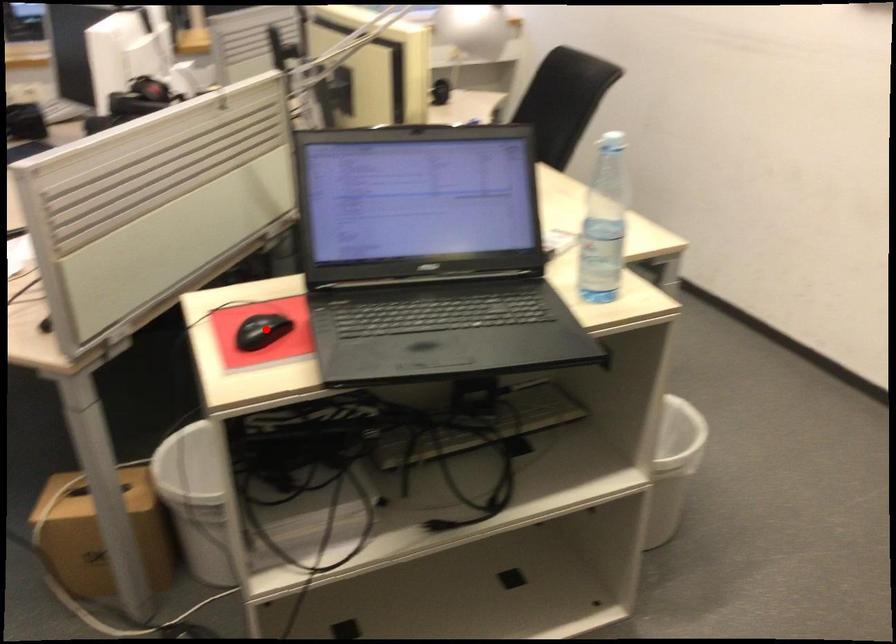
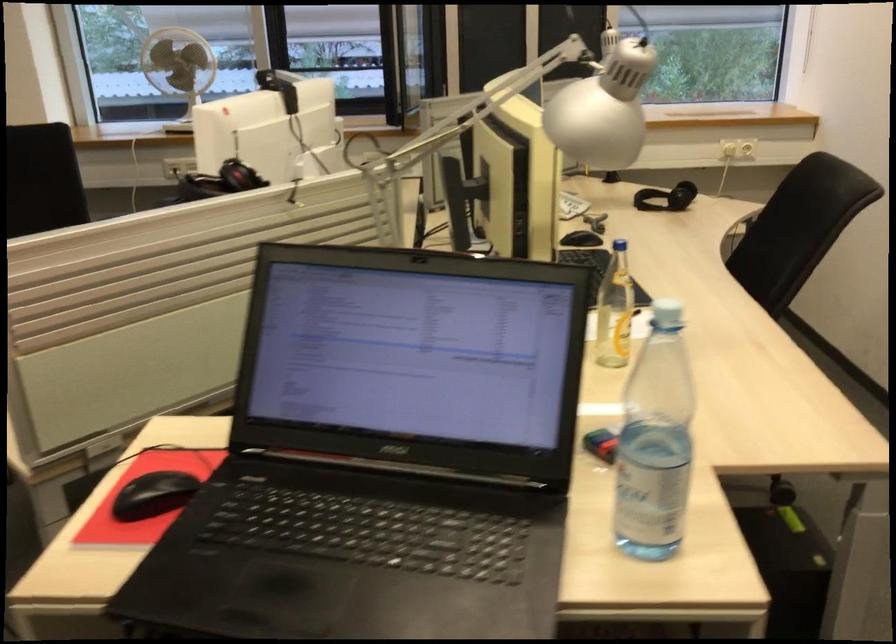
In the second image, find the point that corresponds to the highlighted location in the first image.

(153, 495)